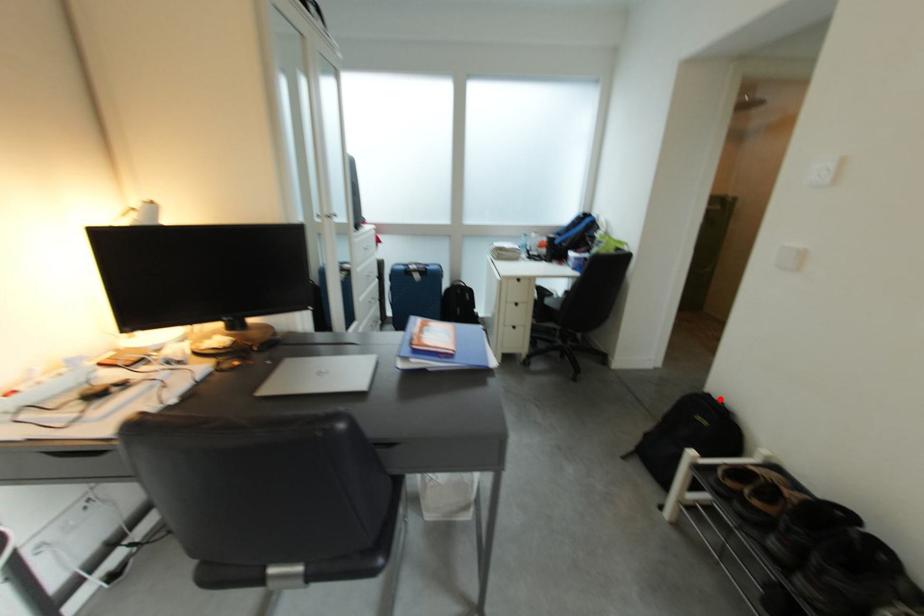
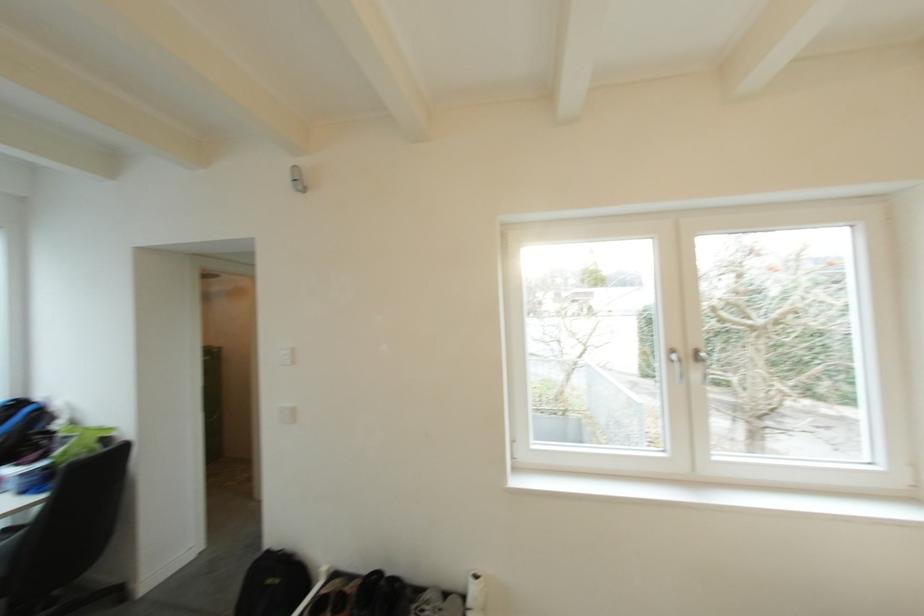
Find the pixel in the second image that matches the highlighted location in the first image.

(280, 554)